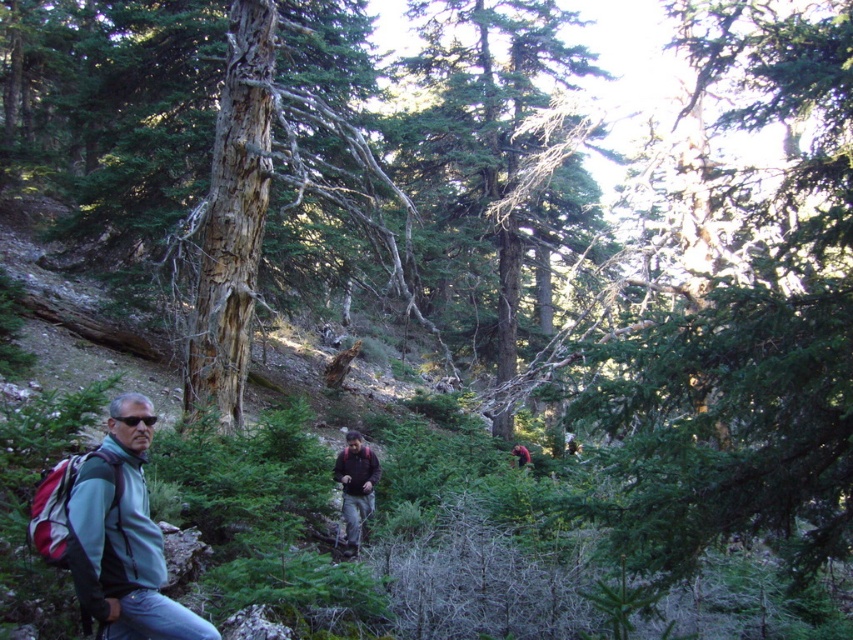
From the picture: Who is positioned more to the left, green needle-like tree at upper center or dark brown fabric at center?

dark brown fabric at center

This screenshot has height=640, width=853. What do you see at coordinates (747, 326) in the screenshot? I see `green needle-like tree at upper center` at bounding box center [747, 326].

This screenshot has height=640, width=853. I want to click on green needle-like tree at upper center, so click(747, 326).

Describe the element at coordinates (492, 157) in the screenshot. I see `green textured tree at center` at that location.

Between point (503, 65) and point (341, 484), which one is positioned in front?

Point (341, 484)

You are a GUI agent. You are given a task and a screenshot of the screen. Output one action in this format:
    pyautogui.click(x=<x>, y=<y>)
    Task: Click on the green textured tree at center
    
    Given the screenshot: What is the action you would take?
    pyautogui.click(x=492, y=157)

Which of these two, green needle-like tree at upper center or dark brown leather jacket at center, stands shorter?

dark brown leather jacket at center is shorter.

Is green needle-like tree at upper center thinner than dark brown leather jacket at center?

In fact, green needle-like tree at upper center might be wider than dark brown leather jacket at center.

The height and width of the screenshot is (640, 853). Describe the element at coordinates (747, 326) in the screenshot. I see `green needle-like tree at upper center` at that location.

Locate an element on the screen. This screenshot has height=640, width=853. green needle-like tree at upper center is located at coordinates (747, 326).